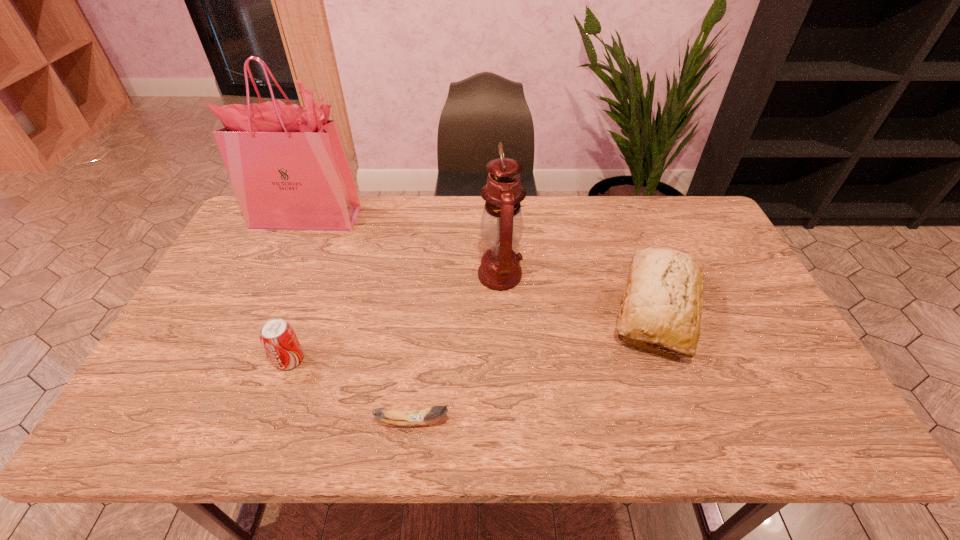
Where is `vacant area that lies between the oil lamp and the bread`? This screenshot has height=540, width=960. vacant area that lies between the oil lamp and the bread is located at coordinates point(578,292).

Locate which object is the closest to the rightmost object. Please provide its 2D coordinates. Your answer should be formatted as a tuple, i.e. [(x, y)], where the tuple contains the x and y coordinates of a point satisfying the conditions above.

[(502, 224)]

At what (x,y) coordinates should I click in order to perform the action: click on object that is the third closest one to the rightmost object. Please return your answer as a coordinate pair (x, y). The width and height of the screenshot is (960, 540). Looking at the image, I should click on (287, 164).

Find the location of a particular element. This screenshot has height=540, width=960. free space that satisfies the following two spatial constraints: 1. on the front side of the bread; 2. on the left side of the oil lamp is located at coordinates (501, 309).

Locate an element on the screen. The width and height of the screenshot is (960, 540). vacant area that satisfies the following two spatial constraints: 1. on the front side of the bread; 2. at the stem of the third object from left to right is located at coordinates (699, 422).